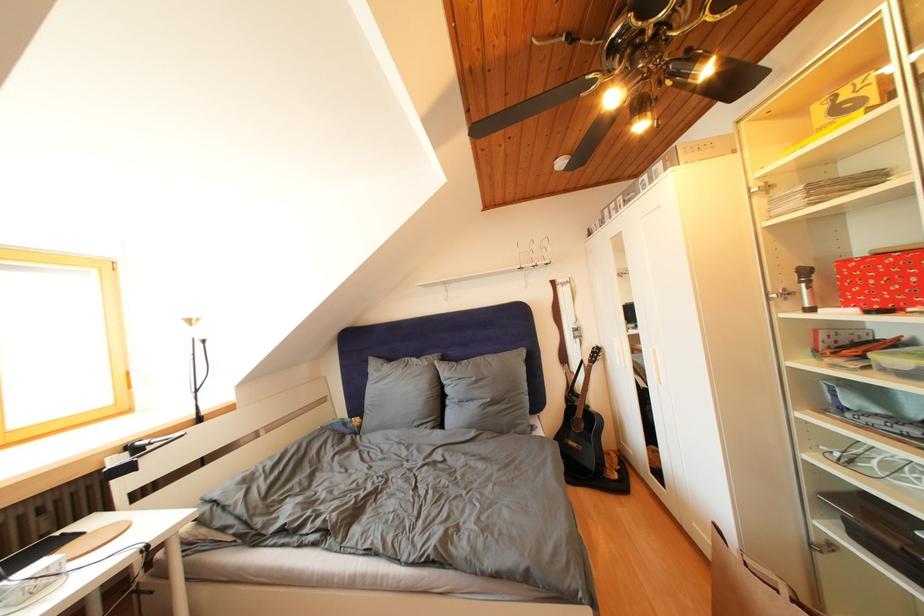
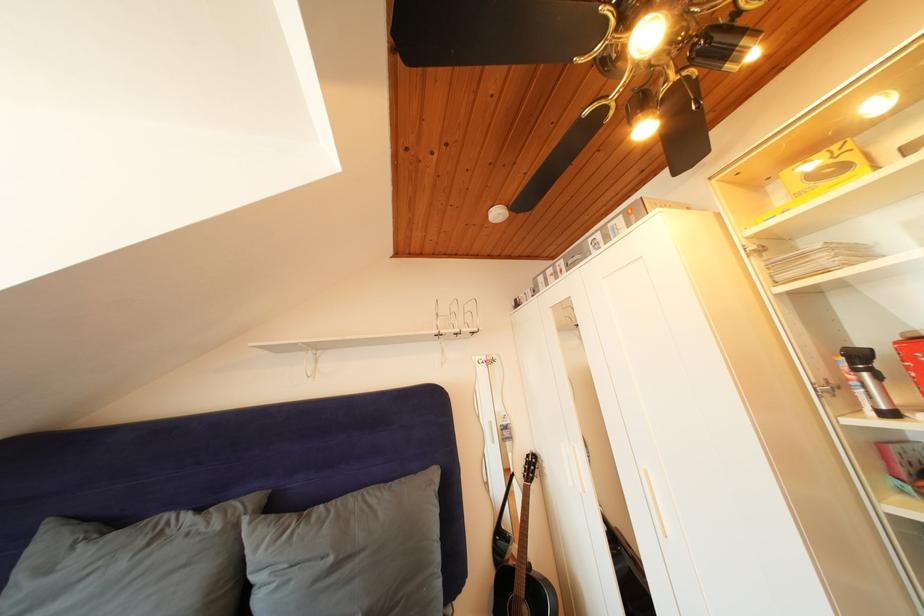
The point at (541,270) is marked in the first image. Where is the corresponding point in the second image?

(466, 336)